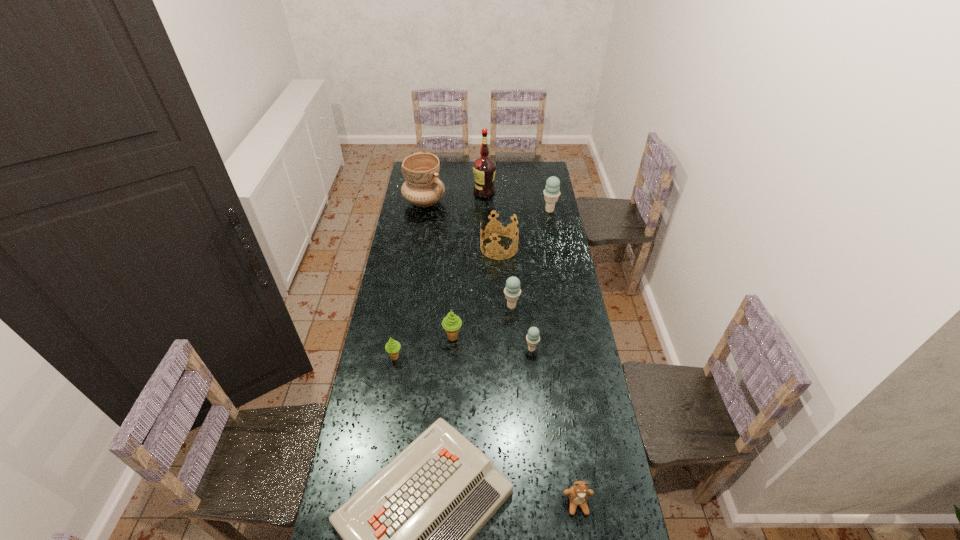
What are the coordinates of `object identified as the ninth closest to the nearer green icecream` in the screenshot? It's located at (551, 193).

The width and height of the screenshot is (960, 540). I want to click on object that can be found as the fifth closest to the teddy bear, so click(512, 291).

In order to click on icecream that is the closest to the pottery in this screenshot , I will do `click(551, 193)`.

The image size is (960, 540). Find the location of `the fourth closest icecream to the second biggest blue ice cream`. the fourth closest icecream to the second biggest blue ice cream is located at coordinates (551, 193).

In order to click on blue ice cream that can be found as the closest to the third icecream from right to left in this screenshot , I will do click(x=533, y=338).

This screenshot has height=540, width=960. What are the coordinates of `blue ice cream that is the second closest to the crown` in the screenshot? It's located at [x=512, y=291].

This screenshot has width=960, height=540. Identify the location of free spot that satisfies the following two spatial constraints: 1. on the label of the seventh nearest object; 2. on the left side of the brown alcohol. (485, 247).

Locate an element on the screen. The width and height of the screenshot is (960, 540). free point that satisfies the following two spatial constraints: 1. on the back side of the crown; 2. on the label of the tallest object is located at coordinates (x=496, y=192).

What are the coordinates of `free space that satisfies the following two spatial constraints: 1. on the label of the alcohol; 2. on the back side of the smallest blue ice cream` in the screenshot? It's located at (486, 349).